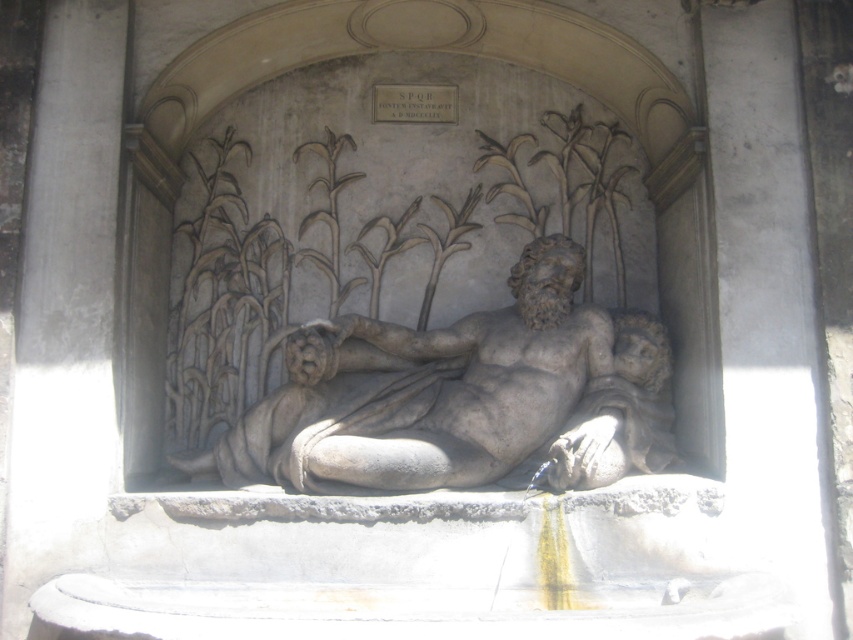
Wait, the objects list has two entries that seem to refer to the same entity. The first is labeled as gray stone reclining man at center and the second as gray stone reclining figure at center. Are these two distinct objects or duplicates? Please clarify using the scene description provided.

The two labels refer to the same object. The scene description mentions a single reclining male figure, so the terms man and figure are used interchangeably here.

You are an art conservator assessing the sculpture. You need to determine if the gray stone reclining man at center can be moved through a doorway that is narrower than the gray stone reclining figure at center. Can it fit through the doorway?

The gray stone reclining man at center is wider than the gray stone reclining figure at center. Since the doorway is narrower than the gray stone reclining figure at center, the gray stone reclining man at center cannot fit through the doorway.

You are standing in front of the classical relief sculpture. You want to take a photo of the point at coordinate point (279, 480). If your camera is 21.59 feet away from the point, will you be able to capture the entire sculpture in the frame?

The point (279, 480) is 21.59 feet away from the camera, so yes, you can capture the entire sculpture in the frame since the distance matches the required focal length.